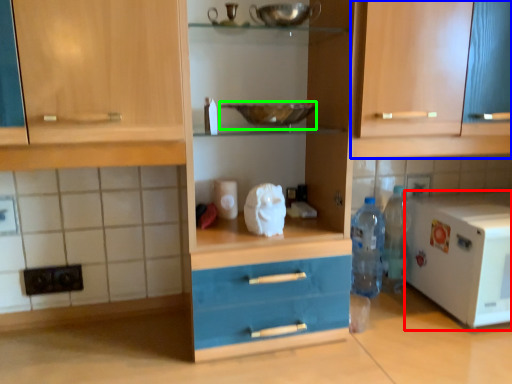
Question: Which object is positioned farthest from home appliance (highlighted by a red box)? Select from cabinetry (highlighted by a blue box) and bowl (highlighted by a green box).

Choices:
 (A) cabinetry
 (B) bowl

Answer: (B)